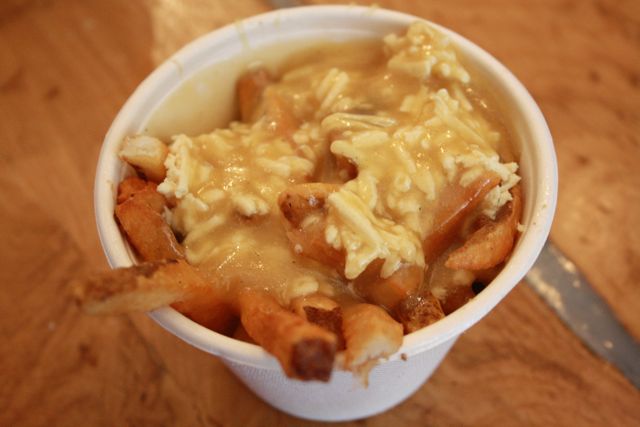
What are the coordinates of `rim of the cup` in the screenshot? It's located at (445, 327).